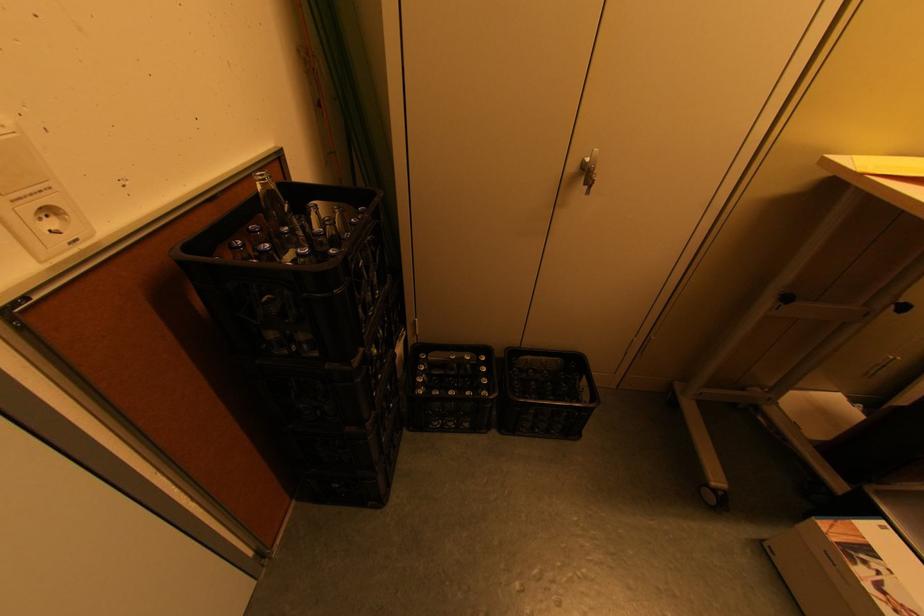
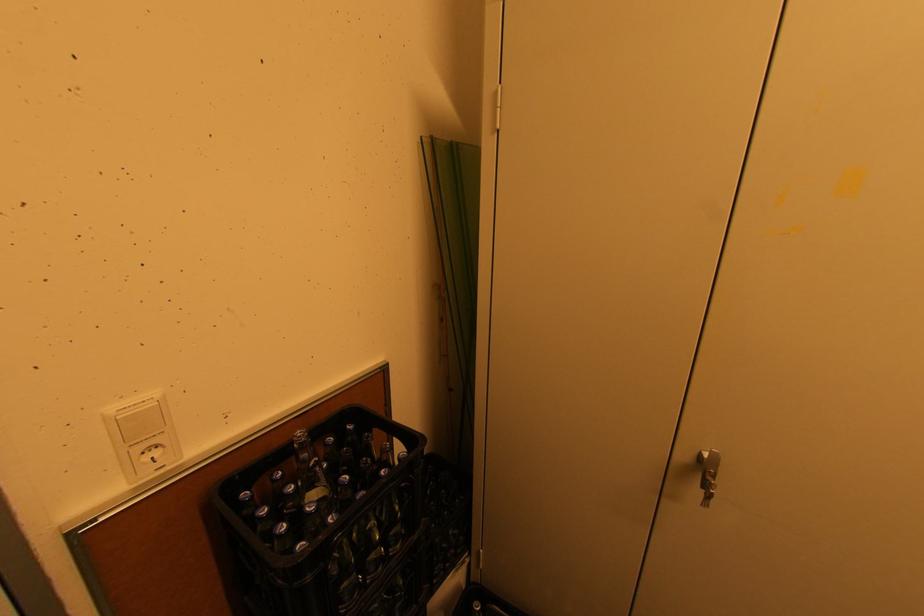
Based on the continuous images, in which direction is the camera rotating?

The rotation direction of the camera is left-up.